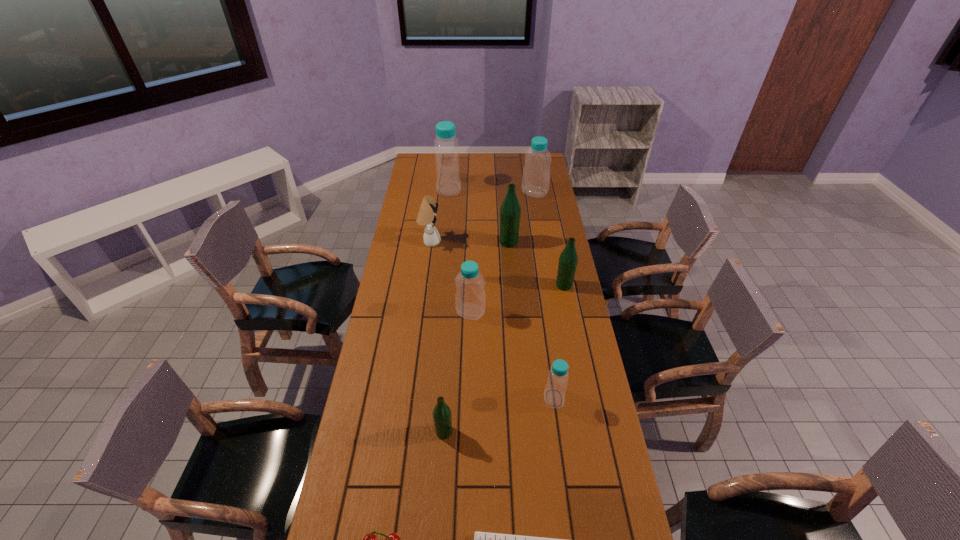
Image resolution: width=960 pixels, height=540 pixels. What are the coordinates of `unoccupied position between the second farthest green bottle and the nearest blue bottle` in the screenshot? It's located at (559, 342).

This screenshot has height=540, width=960. What are the coordinates of `free spot between the biggest green bottle and the sixth farthest bottle` in the screenshot? It's located at (531, 320).

Identify which object is located as the seventh nearest to the second farthest green bottle. Please provide its 2D coordinates. Your answer should be formatted as a tuple, i.e. [(x, y)], where the tuple contains the x and y coordinates of a point satisfying the conditions above.

[(448, 183)]

This screenshot has width=960, height=540. Identify the location of the eighth closest object to the fifth farthest bottle. (x=448, y=183).

Identify which bottle is the third closest to the red cherry. Please provide its 2D coordinates. Your answer should be formatted as a tuple, i.e. [(x, y)], where the tuple contains the x and y coordinates of a point satisfying the conditions above.

[(470, 299)]

Locate which bottle ranks third in proximity to the rightmost green bottle. Please provide its 2D coordinates. Your answer should be formatted as a tuple, i.e. [(x, y)], where the tuple contains the x and y coordinates of a point satisfying the conditions above.

[(554, 394)]

Choose which blue bottle is the fourth nearest neighbor to the farthest green bottle. Please provide its 2D coordinates. Your answer should be formatted as a tuple, i.e. [(x, y)], where the tuple contains the x and y coordinates of a point satisfying the conditions above.

[(554, 394)]

The width and height of the screenshot is (960, 540). What are the coordinates of `blue bottle object that ranks as the third closest to the fifth nearest bottle` in the screenshot? It's located at (448, 183).

The width and height of the screenshot is (960, 540). I want to click on green bottle object that ranks as the closest to the sixth farthest object, so click(568, 259).

Where is `green bottle that is the third closest to the smallest blue bottle`? This screenshot has width=960, height=540. green bottle that is the third closest to the smallest blue bottle is located at coordinates (510, 211).